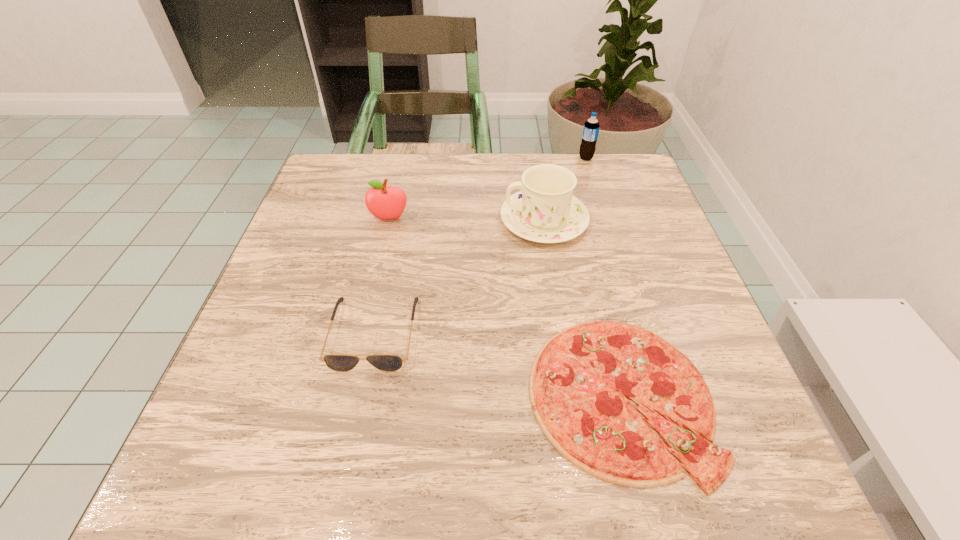
You are a GUI agent. You are given a task and a screenshot of the screen. Output one action in this format:
    pyautogui.click(x=<x>, y=<y>)
    Task: Click on the empty space that is in between the farthest object and the sunglasses
    The image size is (960, 540).
    Given the screenshot: What is the action you would take?
    pyautogui.click(x=480, y=245)

Identify the location of vacant area between the chinaware and the sunglasses. This screenshot has height=540, width=960. (459, 276).

Identify the location of vacant area between the shortest object and the apple. The width and height of the screenshot is (960, 540). (505, 308).

The height and width of the screenshot is (540, 960). Identify the location of blank region between the apple and the farthest object. (488, 188).

Find the location of a particular element. The height and width of the screenshot is (540, 960). empty location between the farthest object and the apple is located at coordinates (488, 188).

The width and height of the screenshot is (960, 540). I want to click on blank region between the shortest object and the apple, so click(505, 308).

You are a GUI agent. You are given a task and a screenshot of the screen. Output one action in this format:
    pyautogui.click(x=<x>, y=<y>)
    Task: Click on the blank region between the pizza and the apple
    The width and height of the screenshot is (960, 540).
    Given the screenshot: What is the action you would take?
    pyautogui.click(x=505, y=308)

Locate an element on the screen. object that is the second closest to the shortest object is located at coordinates (545, 211).

You are a GUI agent. You are given a task and a screenshot of the screen. Output one action in this format:
    pyautogui.click(x=<x>, y=<y>)
    Task: Click on the fourth closest object to the pizza
    The height and width of the screenshot is (540, 960).
    Given the screenshot: What is the action you would take?
    pyautogui.click(x=591, y=127)

You are a GUI agent. You are given a task and a screenshot of the screen. Output one action in this format:
    pyautogui.click(x=<x>, y=<y>)
    Task: Click on the free space that satisfies the following two spatial constraints: 1. on the front side of the apple; 2. on the right side of the shortest object
    The width and height of the screenshot is (960, 540).
    Given the screenshot: What is the action you would take?
    pyautogui.click(x=348, y=397)